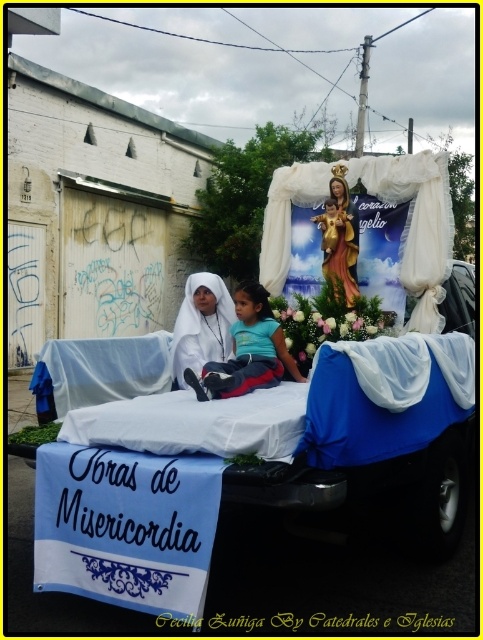
You are standing at the front of the religious float and want to hand a flower to both the blue cotton shirt at center and the white glossy statue at center. Which one should you approach first?

The blue cotton shirt at center is closer to the viewer than the white glossy statue at center, so you should approach the blue cotton shirt at center first.